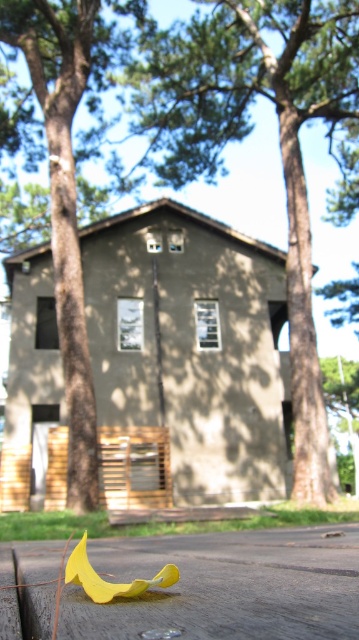
Question: Is brown textured wood at center to the right of brown wood tree at center from the viewer's perspective?

Choices:
 (A) yes
 (B) no

Answer: (A)

Question: Can you confirm if brown textured wood at center is wider than brown wood tree at center?

Choices:
 (A) yes
 (B) no

Answer: (A)

Question: Is brown textured wood at center wider than brown wood tree at center?

Choices:
 (A) no
 (B) yes

Answer: (B)